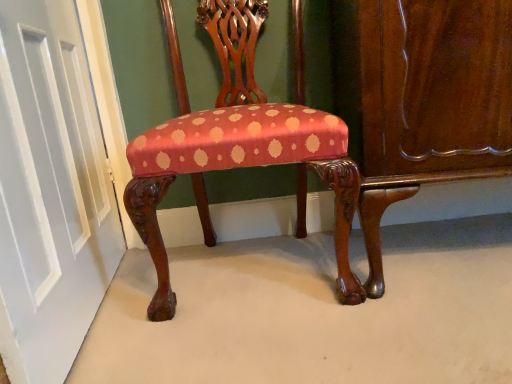
At what (x,y) coordinates should I click in order to perform the action: click on free location in front of silky red fabric chair at center. Please return your answer as a coordinate pair (x, y). Looking at the image, I should click on (282, 344).